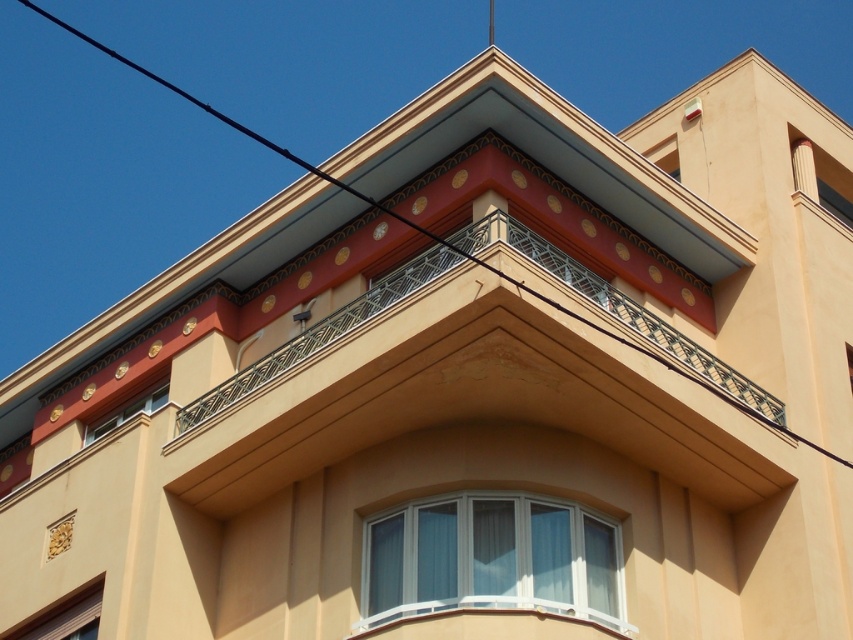
You are an architect inspecting the building facade. You notice the white plastic window at center and the matte beige window at lower left. Which window has a bigger surface area?

The white plastic window at center is larger in size than the matte beige window at lower left, so it has a bigger surface area.

You are standing in front of the building and notice two points marked on the facade. The first point is at coordinates point (91,616) and the second is at point (135,403). Which point appears closer to you?

Point (91,616) is closer to the camera than point (135,403), so the first point is closer to you.